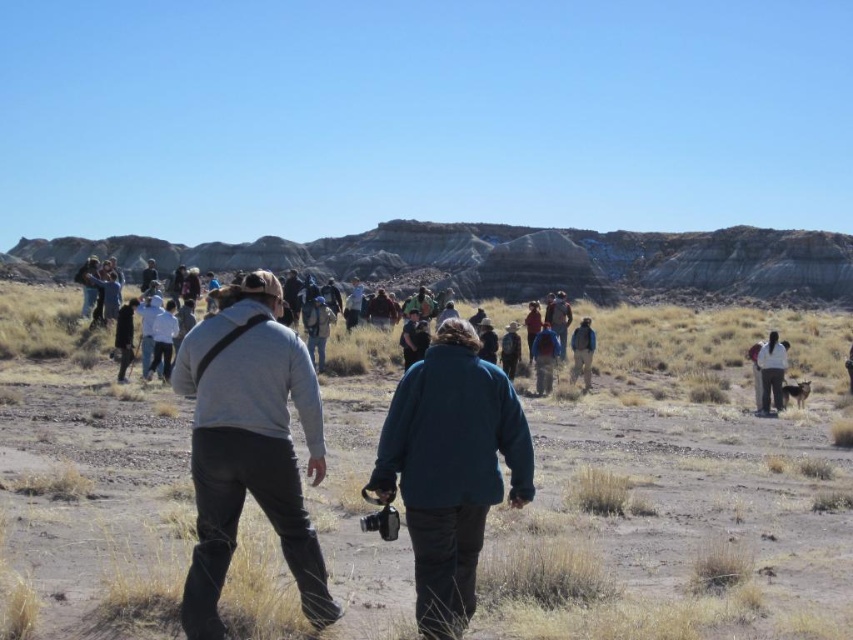
You are standing in the desert scene and notice two jackets. Which jacket, the white fabric jacket at right or the blue denim jacket at center, is closer to the ground?

The white fabric jacket at right is closer to the ground because it is positioned under the blue denim jacket at center.

You are a photographer trying to capture a group shot of the two people in the desert. You notice that the dark green fleece jacket at center and the blue denim jacket at center are positioned close to each other. Which jacket would appear wider in the photo?

The dark green fleece jacket at center would appear wider in the photo since its width surpasses that of the blue denim jacket at center according to the description.